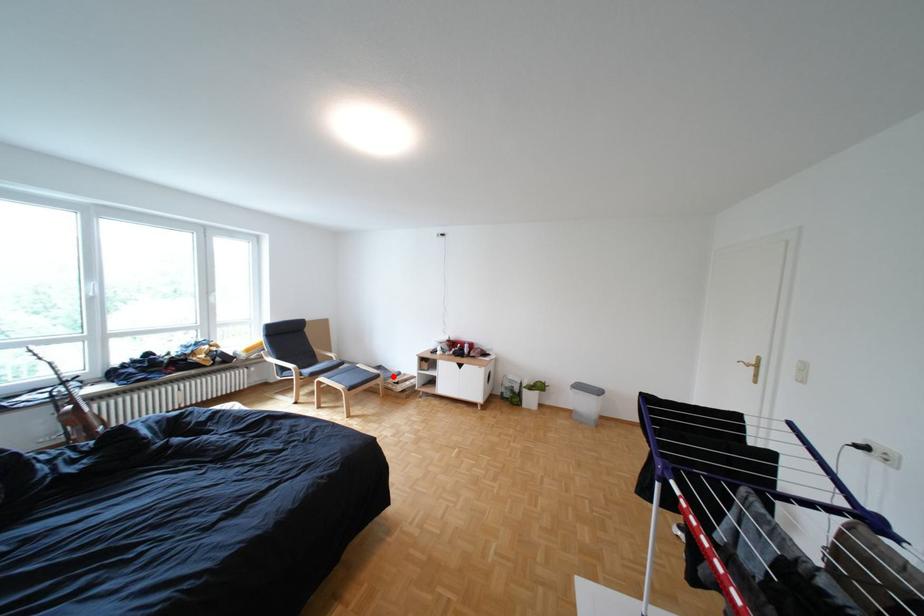
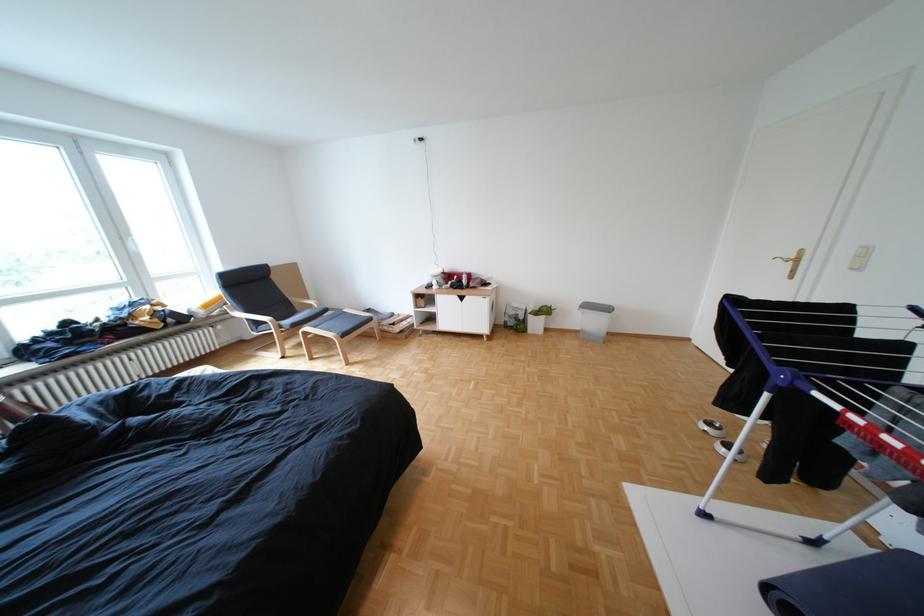
Question: I am providing you with two images of the same scene from different viewpoints. A red point is marked on the first image. Is the red point's position out of view in image 2?

Choices:
 (A) Yes
 (B) No

Answer: (B)